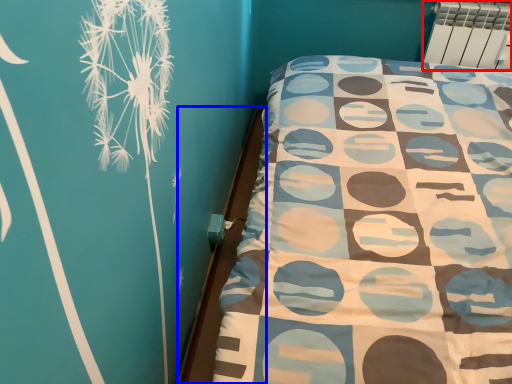
Question: Among these objects, which one is nearest to the camera, radiator (highlighted by a red box) or bed frame (highlighted by a blue box)?

Choices:
 (A) radiator
 (B) bed frame

Answer: (B)